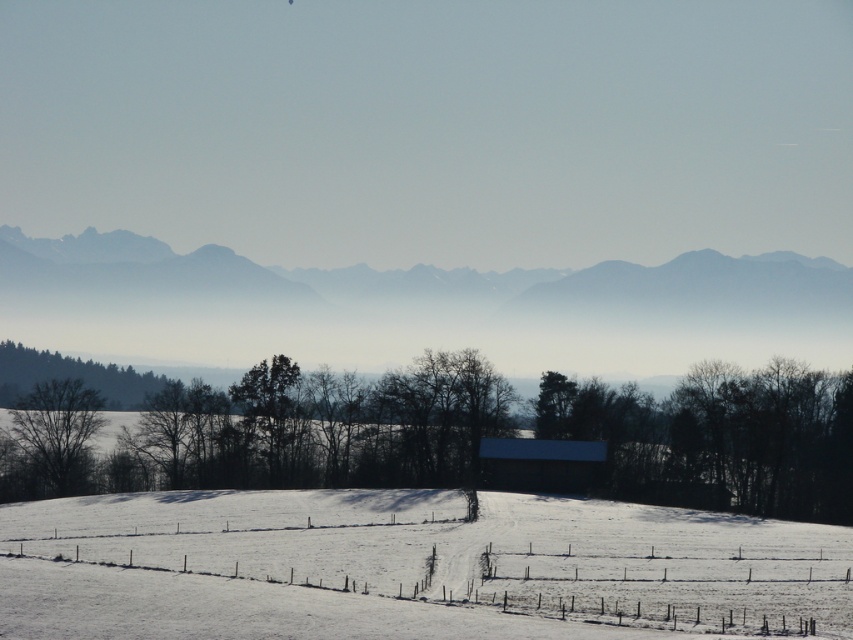
Based on the photo, can you confirm if smooth brown tree at center is positioned below white wooden fence at lower center?

Incorrect, smooth brown tree at center is not positioned below white wooden fence at lower center.

Can you confirm if smooth brown tree at center is smaller than white wooden fence at lower center?

Incorrect, smooth brown tree at center is not smaller in size than white wooden fence at lower center.

Which is behind, point (677, 419) or point (47, 576)?

Positioned behind is point (677, 419).

You are a GUI agent. You are given a task and a screenshot of the screen. Output one action in this format:
    pyautogui.click(x=<x>, y=<y>)
    Task: Click on the smooth brown tree at center
    This screenshot has height=640, width=853.
    Given the screenshot: What is the action you would take?
    pyautogui.click(x=297, y=432)

Can you confirm if smooth brown tree at center is positioned to the right of bare wood tree at left?

Yes, smooth brown tree at center is to the right of bare wood tree at left.

Does smooth brown tree at center have a greater width compared to bare wood tree at left?

Yes, smooth brown tree at center is wider than bare wood tree at left.

Where is `smooth brown tree at center`? The image size is (853, 640). smooth brown tree at center is located at coordinates click(297, 432).

Which of these two, white wooden fence at lower center or bare wood tree at left, stands taller?

Standing taller between the two is bare wood tree at left.

Locate an element on the screen. The height and width of the screenshot is (640, 853). white wooden fence at lower center is located at coordinates (252, 609).

The width and height of the screenshot is (853, 640). What are the coordinates of `white wooden fence at lower center` in the screenshot? It's located at point(252,609).